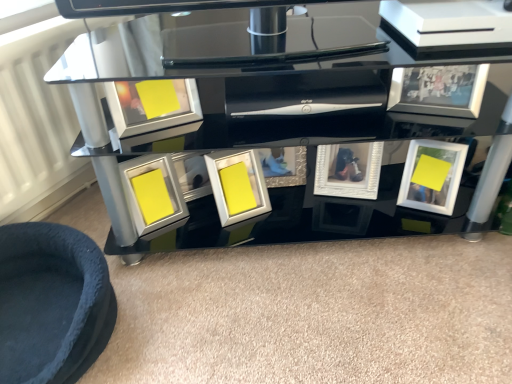
The image size is (512, 384). What are the coordinates of `vacant area that lies between white glossy picture frame at lower right, the sixth picture frame in the left-to-right sequence, and velvet blue pet bed at lower left` in the screenshot? It's located at (265, 271).